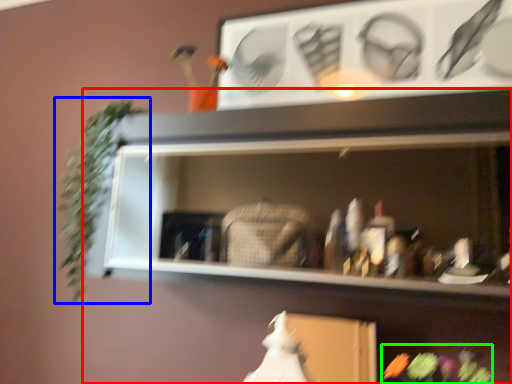
Question: Estimate the real-world distances between objects in this image. Which object is farther from shelf (highlighted by a red box), plant (highlighted by a blue box) or flower (highlighted by a green box)?

Choices:
 (A) plant
 (B) flower

Answer: (A)